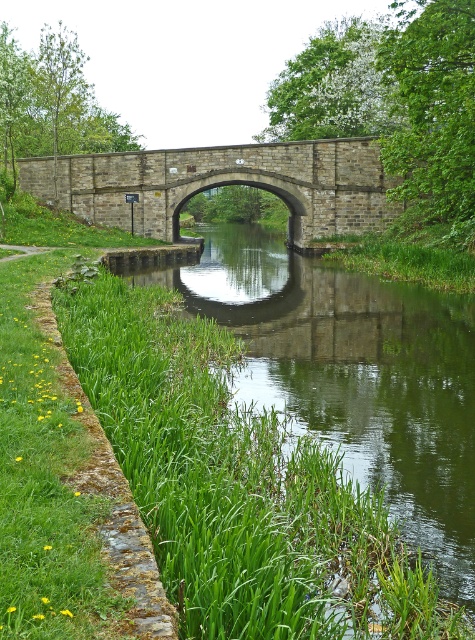
Between green grassy stream at lower left and brown stone bridge at center, which one is positioned lower?

Positioned lower is green grassy stream at lower left.

Does green grassy stream at lower left have a larger size compared to brown stone bridge at center?

Correct, green grassy stream at lower left is larger in size than brown stone bridge at center.

Does point (461, 536) come in front of point (121, 212)?

Yes, it is in front of point (121, 212).

Identify the location of green grassy stream at lower left. The width and height of the screenshot is (475, 640). (353, 376).